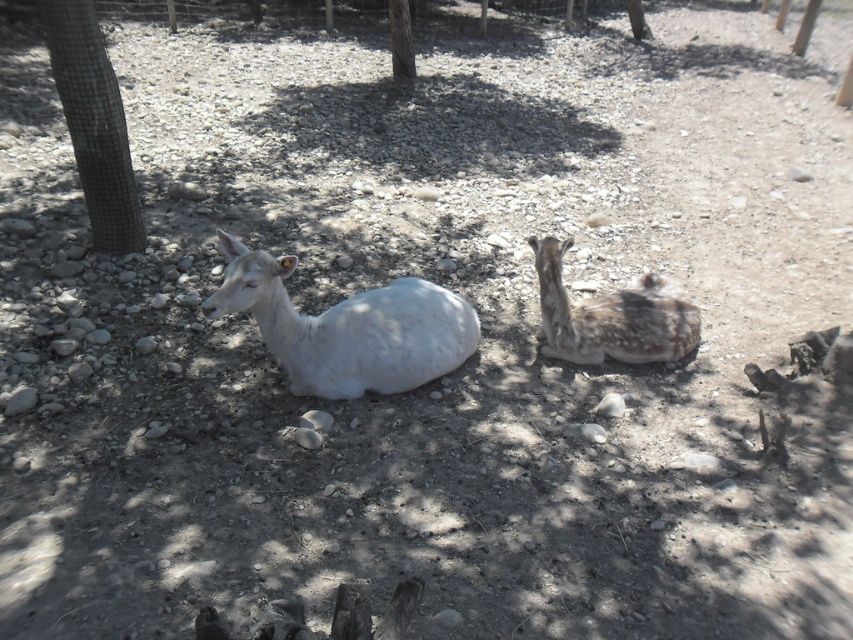
Question: Which point is farther from the camera taking this photo?

Choices:
 (A) click(233, 275)
 (B) click(59, 29)
 (C) click(393, 77)

Answer: (C)

Question: Observing the image, what is the correct spatial positioning of white fur goat at center in reference to mesh wire fence at upper left?

Choices:
 (A) below
 (B) above

Answer: (A)

Question: Observing the image, what is the correct spatial positioning of mesh wire fence at upper left in reference to fawn fur coat at center?

Choices:
 (A) left
 (B) right

Answer: (A)

Question: Where is mesh wire fence at upper left located in relation to smooth bark tree at upper center in the image?

Choices:
 (A) right
 (B) left

Answer: (B)

Question: Among these points, which one is farthest from the camera?

Choices:
 (A) (397, 24)
 (B) (685, 333)
 (C) (107, 54)

Answer: (A)

Question: Estimate the real-world distances between objects in this image. Which object is closer to the smooth bark tree at upper center?

Choices:
 (A) mesh wire fence at upper left
 (B) fawn fur coat at center

Answer: (A)